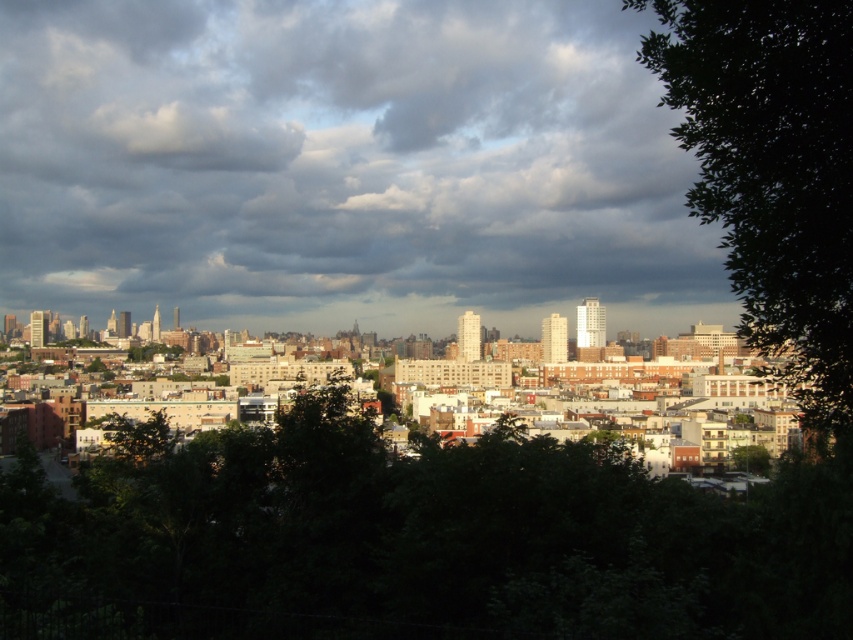
Question: Which object is closer to the camera taking this photo?

Choices:
 (A) cloudy sky at upper center
 (B) green leafy tree at right
 (C) green leafy tree at center

Answer: (B)

Question: Estimate the real-world distances between objects in this image. Which object is closer to the green leafy tree at center?

Choices:
 (A) cloudy sky at upper center
 (B) green leafy tree at right

Answer: (A)

Question: Does cloudy sky at upper center appear under green leafy tree at center?

Choices:
 (A) yes
 (B) no

Answer: (B)

Question: Does cloudy sky at upper center appear under green leafy tree at right?

Choices:
 (A) no
 (B) yes

Answer: (A)

Question: Which of the following is the farthest from the observer?

Choices:
 (A) green leafy tree at right
 (B) cloudy sky at upper center

Answer: (B)

Question: Can you confirm if green leafy tree at center is smaller than green leafy tree at right?

Choices:
 (A) no
 (B) yes

Answer: (B)